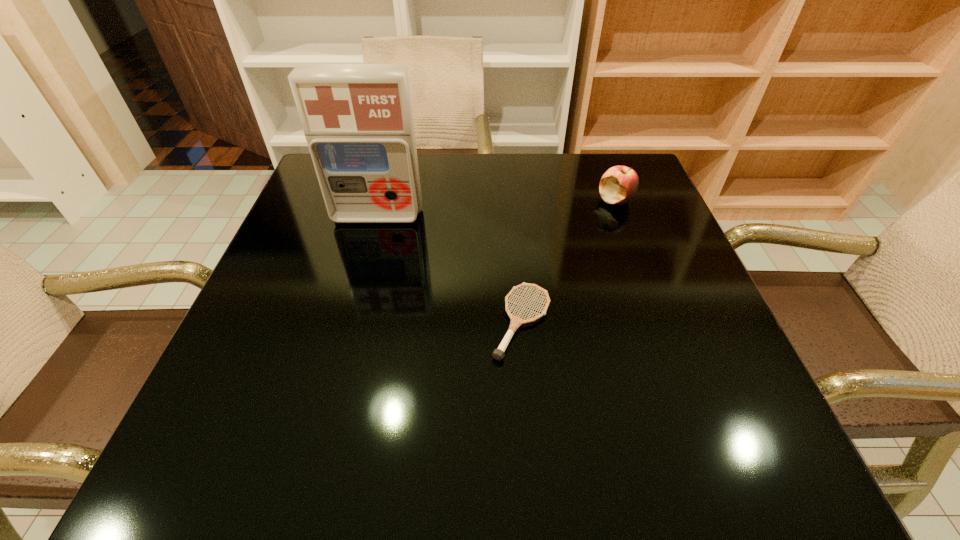
Locate an element on the screen. Image resolution: width=960 pixels, height=540 pixels. vacant area that lies between the leftmost object and the rightmost object is located at coordinates (496, 208).

Image resolution: width=960 pixels, height=540 pixels. I want to click on free spot between the nearest object and the rightmost object, so click(568, 261).

Locate an element on the screen. Image resolution: width=960 pixels, height=540 pixels. empty location between the tennis racket and the second tallest object is located at coordinates (568, 261).

This screenshot has height=540, width=960. Identify the location of free space that is in between the rightmost object and the leftmost object. (496, 208).

Locate an element on the screen. free spot between the shortest object and the leftmost object is located at coordinates (449, 269).

At what (x,y) coordinates should I click in order to perform the action: click on empty space that is in between the first-aid kit and the shortest object. Please return your answer as a coordinate pair (x, y). Looking at the image, I should click on (449, 269).

In order to click on free space between the shortest object and the first-aid kit in this screenshot , I will do `click(449, 269)`.

At what (x,y) coordinates should I click in order to perform the action: click on empty location between the first-aid kit and the apple. Please return your answer as a coordinate pair (x, y). Looking at the image, I should click on (496, 208).

The height and width of the screenshot is (540, 960). Find the location of `free space between the apple and the first-aid kit`. free space between the apple and the first-aid kit is located at coordinates (496, 208).

Find the location of a particular element. This screenshot has height=540, width=960. vacant space in between the rightmost object and the shortest object is located at coordinates (568, 261).